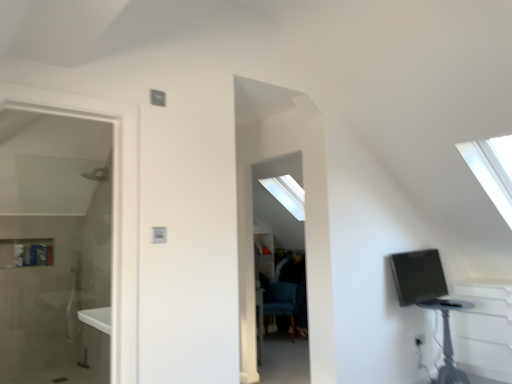
Question: From a real-world perspective, is matte black monitor at right above or below blue fabric swivel chair at center?

Choices:
 (A) above
 (B) below

Answer: (A)

Question: From the image's perspective, relative to blue fabric swivel chair at center, is matte black monitor at right above or below?

Choices:
 (A) below
 (B) above

Answer: (B)

Question: Estimate the real-world distances between objects in this image. Which object is closer to the black plastic table at lower right?

Choices:
 (A) matte black monitor at right
 (B) blue fabric swivel chair at center

Answer: (A)

Question: Estimate the real-world distances between objects in this image. Which object is closer to the blue fabric swivel chair at center?

Choices:
 (A) matte black monitor at right
 (B) black plastic table at lower right

Answer: (B)